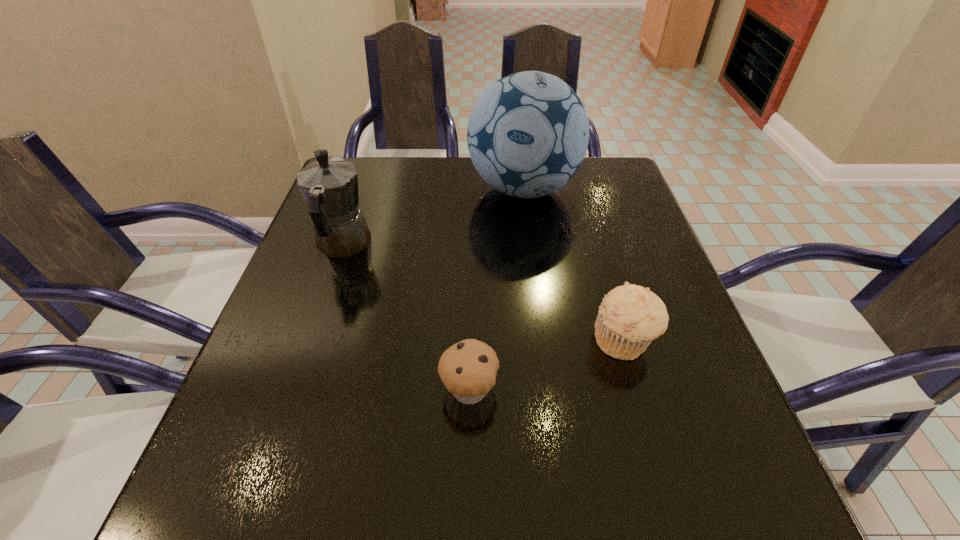
I want to click on soccer ball, so click(528, 133).

Where is `the leftmost object`? This screenshot has width=960, height=540. the leftmost object is located at coordinates (330, 186).

You are a GUI agent. You are given a task and a screenshot of the screen. Output one action in this format:
    pyautogui.click(x=<x>, y=<y>)
    Task: Click on the third shortest object
    The image size is (960, 540).
    Given the screenshot: What is the action you would take?
    pyautogui.click(x=330, y=186)

The height and width of the screenshot is (540, 960). I want to click on the second shortest object, so click(630, 316).

Image resolution: width=960 pixels, height=540 pixels. Find the location of `the right muffin`. the right muffin is located at coordinates (630, 316).

Identify the location of the shorter muffin. (468, 369).

I want to click on the left muffin, so click(x=468, y=369).

In order to click on vacant space located on the side with brand of the tallest object in this screenshot , I will do `click(544, 355)`.

This screenshot has width=960, height=540. Identify the location of free location located on the pouring side of the third shortest object. (362, 191).

Find the location of a particular element. This screenshot has width=960, height=540. vacant space located 0.290m on the pouring side of the third shortest object is located at coordinates (372, 159).